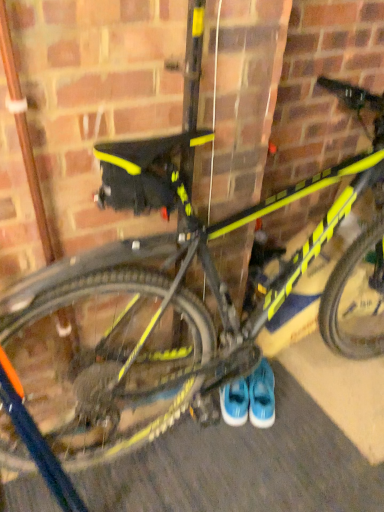
Where is `vacant area that lies to the right of blue suede sneakers at center, which is the first footwear in left-to-right order`? vacant area that lies to the right of blue suede sneakers at center, which is the first footwear in left-to-right order is located at coordinates (288, 390).